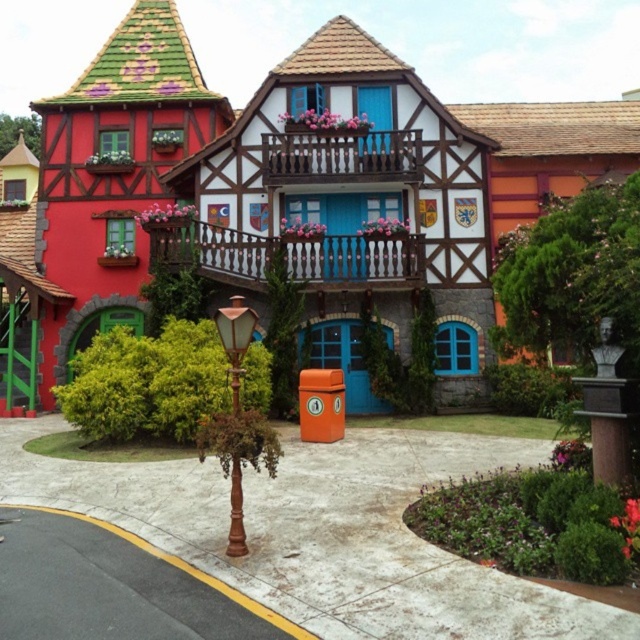
Question: In this image, where is wooden balcony at center located relative to wooden at upper center?

Choices:
 (A) below
 (B) above

Answer: (A)

Question: Is wooden balcony at center bigger than wooden lamp post at center?

Choices:
 (A) yes
 (B) no

Answer: (A)

Question: Which object is the closest to the wooden balcony at center?

Choices:
 (A) wooden at upper center
 (B) wooden lamp post at center

Answer: (A)

Question: Which object appears farthest from the camera in this image?

Choices:
 (A) wooden balcony at center
 (B) wooden lamp post at center
 (C) wooden at upper center

Answer: (C)

Question: Is the position of wooden balcony at center more distant than that of wooden lamp post at center?

Choices:
 (A) no
 (B) yes

Answer: (B)

Question: Estimate the real-world distances between objects in this image. Which object is closer to the wooden lamp post at center?

Choices:
 (A) wooden at upper center
 (B) wooden balcony at center

Answer: (B)